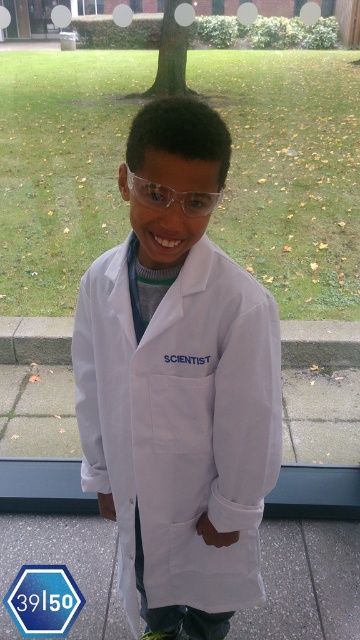
Question: Is white matte lab coat at center in front of transparent plastic goggles at center?

Choices:
 (A) no
 (B) yes

Answer: (A)

Question: In this image, where is white matte lab coat at center located relative to transparent plastic goggles at center?

Choices:
 (A) above
 (B) below

Answer: (B)

Question: Among these objects, which one is farthest from the camera?

Choices:
 (A) white matte lab coat at center
 (B) transparent plastic goggles at center

Answer: (A)

Question: Which point is closer to the camera?

Choices:
 (A) (234, 470)
 (B) (147, 189)

Answer: (B)

Question: Is white matte lab coat at center above transparent plastic goggles at center?

Choices:
 (A) no
 (B) yes

Answer: (A)